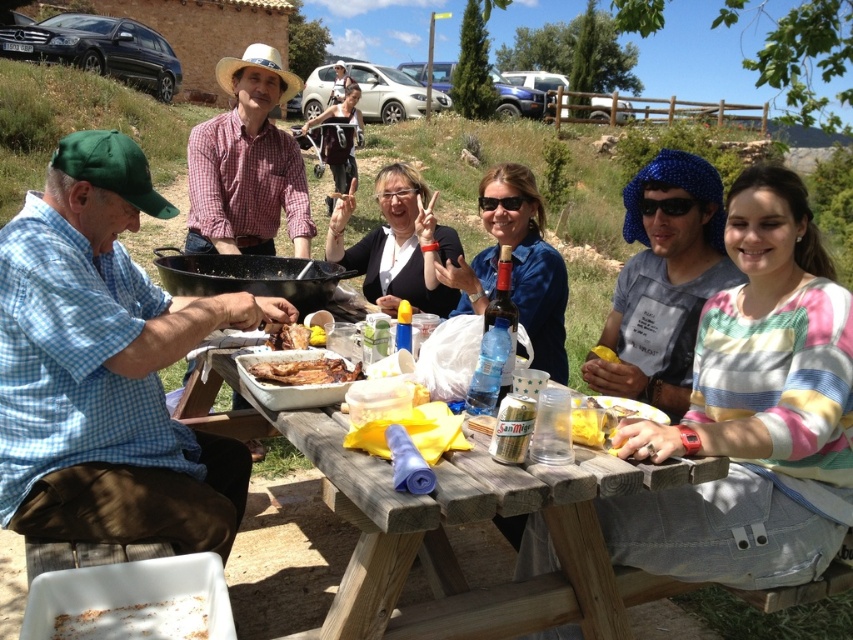
Question: Which of the following is the closest to the observer?

Choices:
 (A) blue checkered shirt at left
 (B) blue fabric at center

Answer: (A)

Question: Is striped cotton shirt at right bigger than yellow plastic cup at lower center?

Choices:
 (A) no
 (B) yes

Answer: (B)

Question: Does white crumbly food at lower left appear on the right side of matte black stroller at center?

Choices:
 (A) no
 (B) yes

Answer: (B)

Question: Which of the following is the closest to the observer?

Choices:
 (A) wooden picnic table at center
 (B) yellow plastic fork at center

Answer: (A)

Question: Considering the relative positions of striped cotton shirt at right and yellow fabric at table center in the image provided, where is striped cotton shirt at right located with respect to yellow fabric at table center?

Choices:
 (A) left
 (B) right

Answer: (B)

Question: Which point is farther from the camera taking this photo?

Choices:
 (A) (836, 326)
 (B) (354, 84)

Answer: (B)